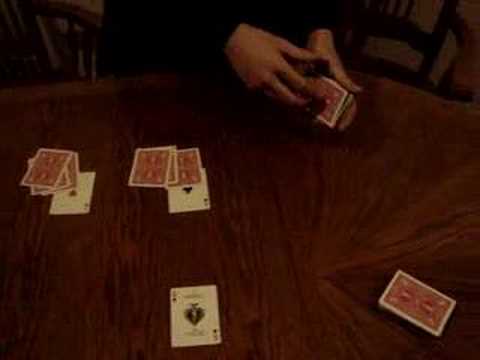
Identify the location of chair. (430, 44).